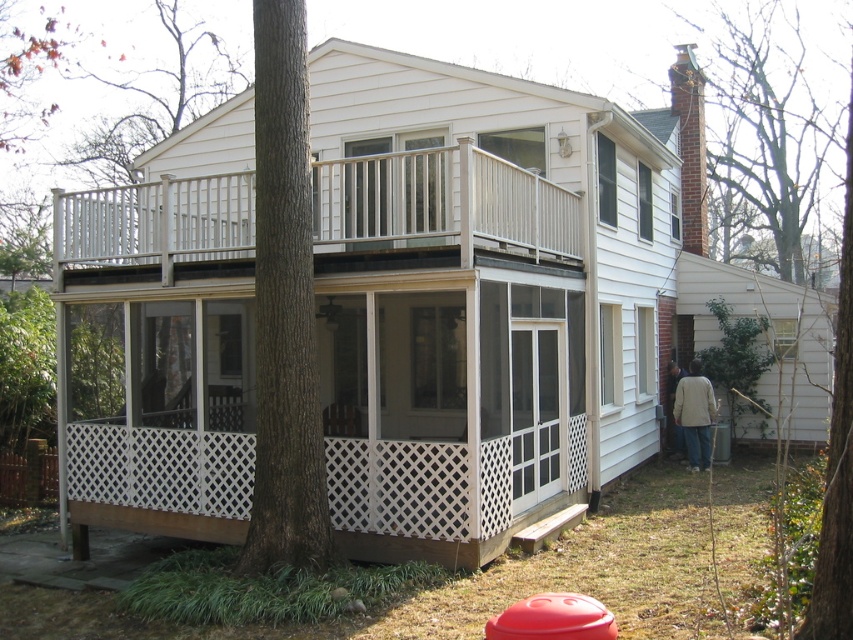
You are a delivery person trying to decide whether to leave a package on the white wood porch at upper center or the light brown jacket at lower right. Which location has more space to place the package?

The white wood porch at upper center is bigger than the light brown jacket at lower right, so it has more space to place the package.

You are standing on the sidewalk in front of the house and want to enter the white wood porch at upper center. To your right, you see the light brown jacket at lower right hanging on a hook. Which direction should you move to reach the porch first?

You should move to the left to reach the white wood porch at upper center first since it is positioned on the left side of the light brown jacket at lower right, meaning the porch is to the left of the jacket from your perspective.